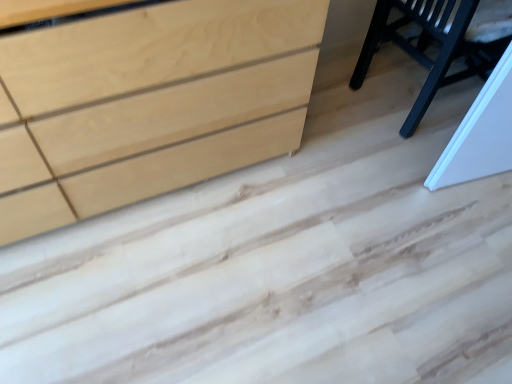
What are the coordinates of `vacant area that lies between natural wood chest of drawers at lower left and glossy black chair at upper right` in the screenshot? It's located at (326, 150).